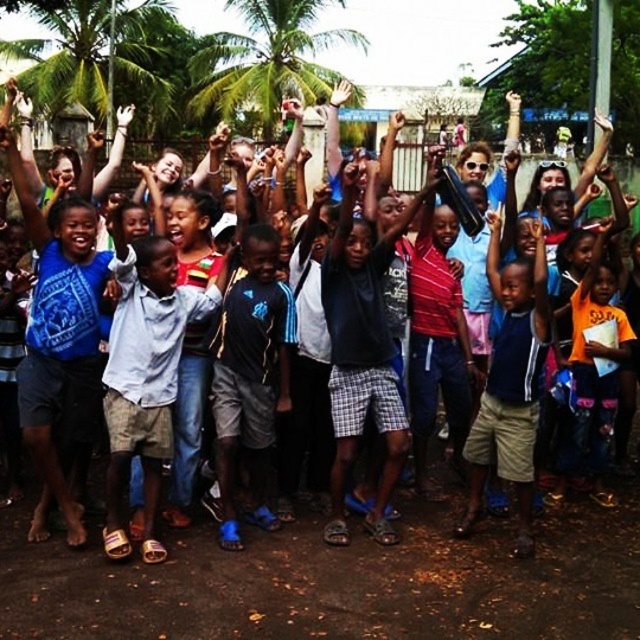
The height and width of the screenshot is (640, 640). Identify the location of light blue fabric shirt at center. (145, 374).

Is point (129, 419) farther from viewer compared to point (273, 26)?

No.

Is point (157, 314) behind point (300, 92)?

No, (157, 314) is closer to viewer.

The width and height of the screenshot is (640, 640). I want to click on light blue fabric shirt at center, so click(x=145, y=374).

Is dark blue tank top at center above green leafy palm tree at upper center?

No.

Is dark blue tank top at center shorter than green leafy palm tree at upper center?

Yes.

Identify the location of dark blue tank top at center. The width and height of the screenshot is (640, 640). (509, 385).

Is point (243, 333) more distant than point (488, 442)?

No.

Between point (276, 337) and point (536, 289), which one is positioned in front?

Point (536, 289) is in front.

What are the coordinates of `dark blue adidas shorts at center` in the screenshot? It's located at (252, 378).